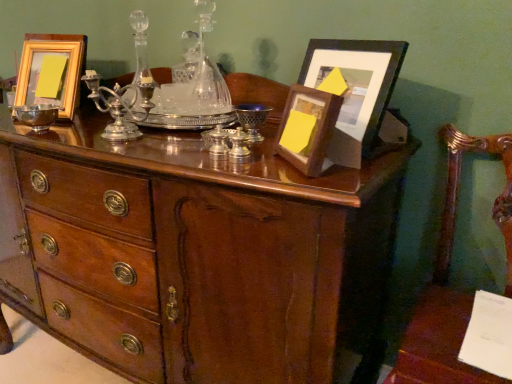
The height and width of the screenshot is (384, 512). In order to click on empty space that is in between shiny silver candle holder at center, which appears as the third candle holder when viewed from the left, and shiny silver bowl at left in this screenshot , I will do `click(111, 142)`.